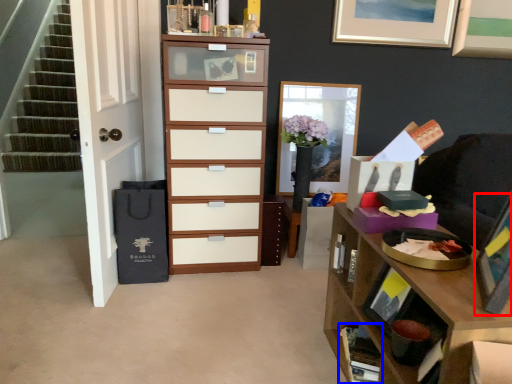
Question: Which object is closer to the camera taking this photo, picture frame (highlighted by a red box) or cabinet (highlighted by a blue box)?

Choices:
 (A) picture frame
 (B) cabinet

Answer: (A)